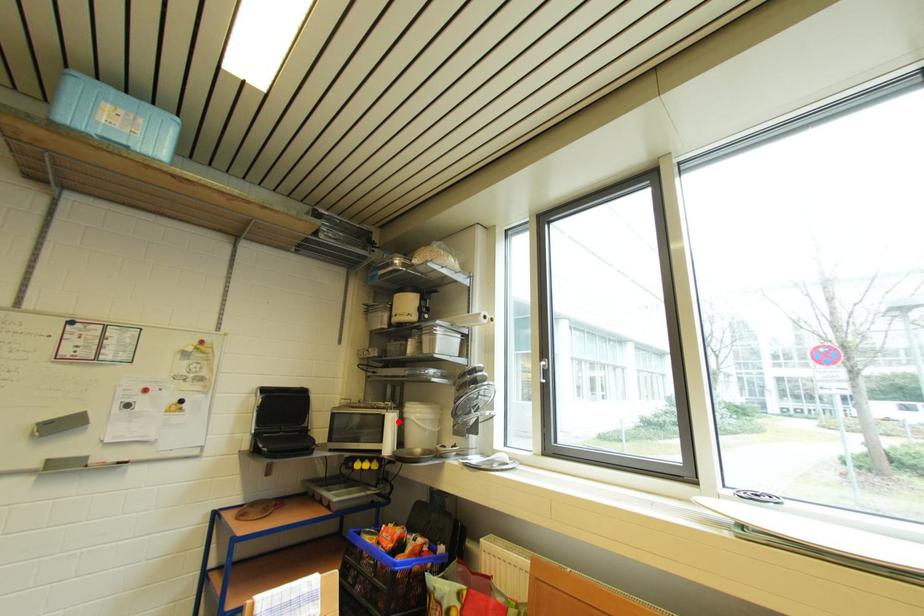
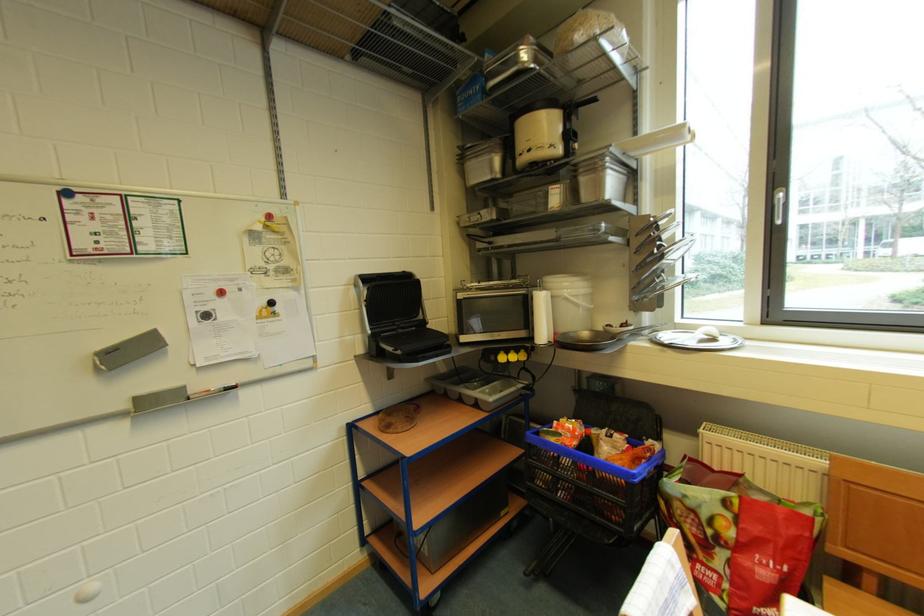
Where in the second image is the point corresponding to the highlighted location from the first image?

(548, 302)